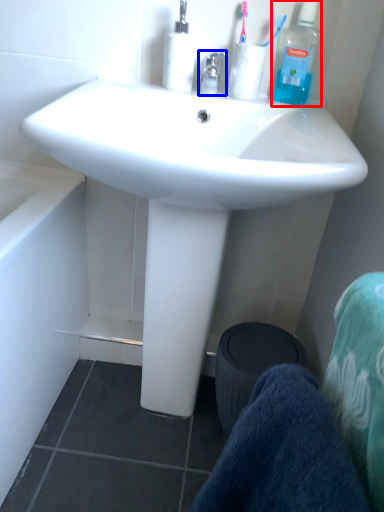
Question: Which object is further to the camera taking this photo, bottle (highlighted by a red box) or faucet (highlighted by a blue box)?

Choices:
 (A) bottle
 (B) faucet

Answer: (A)